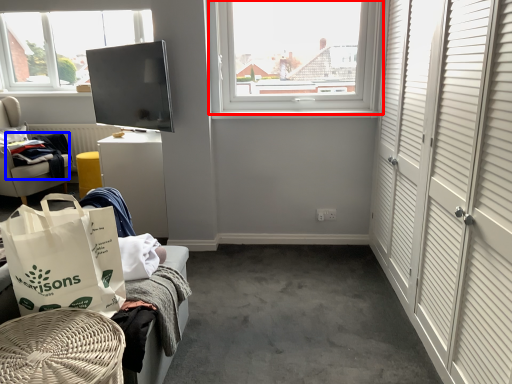
Question: Which point is closer to the camera, window (highlighted by a red box) or clothing (highlighted by a blue box)?

Choices:
 (A) window
 (B) clothing

Answer: (A)